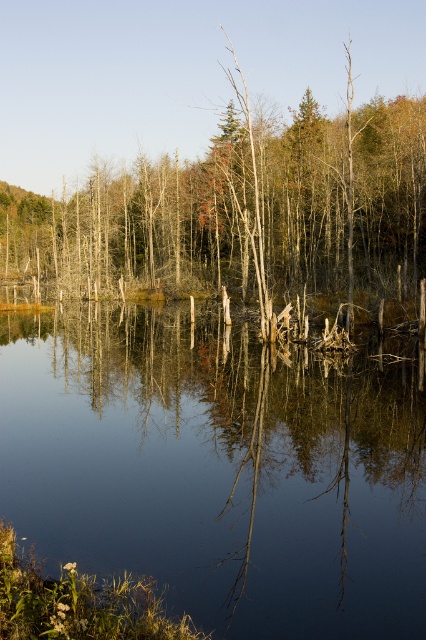
You are a photographer planning to capture the reflection of both the smooth water at center and the smooth bark tree at center. Given their widths, which object will have a narrower reflection in the photo?

The smooth water at center has a narrower reflection than the smooth bark tree at center because its width is less than the tree.

You are standing at the edge of the lake and want to take a photo of both the smooth water at center and the smooth bark tree at center. Which object will appear larger in your camera viewfinder?

The smooth water at center will appear larger in the camera viewfinder because it is closer to the viewer than the smooth bark tree at center.

Looking at this image, you are standing on the edge of a lake and see the smooth water at center and the smooth bark tree at center. Which object appears larger in the scene?

The smooth bark tree at center appears larger than the smooth water at center.